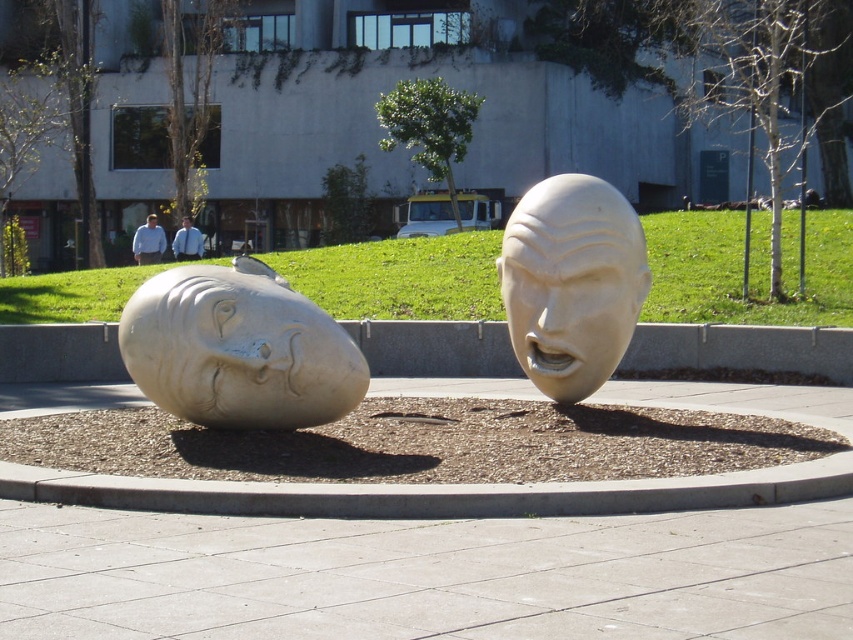
You are an artist planning to place a new sculpture between the white stone head at left and the white marble head at center. The new sculpture must be narrower than both existing sculptures. Can you confirm if this is possible?

The white stone head at left is wider than the white marble head at center. Since the new sculpture must be narrower than both, it needs to be narrower than the narrower of the two, which is the white marble head at center. Therefore, it is possible to create such a sculpture.

You are an art student analyzing the sculpture arrangement. You notice the white stone head at left and the white marble head at center. Which one is positioned more to the left side of the installation?

The white stone head at left is positioned more to the left side of the installation compared to the white marble head at center.

You are standing in front of the public art installation and want to take a photo of the point at coordinates point (274,276). If your camera has a maximum focus range of 10 meters, will it be able to focus on that point?

The distance of point (274,276) from viewer is 11.67 meters, which exceeds the camera maximum focus range of 10 meters. Therefore, the camera cannot focus on that point.